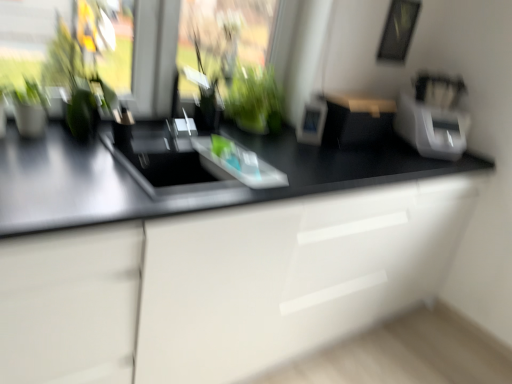
You are a GUI agent. You are given a task and a screenshot of the screen. Output one action in this format:
    pyautogui.click(x=<x>, y=<y>)
    Task: Click on the white plastic knife block at right, the 3th appliance in the left-to-right sequence
    Image resolution: width=512 pixels, height=384 pixels.
    Given the screenshot: What is the action you would take?
    pyautogui.click(x=433, y=116)

What do you see at coordinates (28, 35) in the screenshot?
I see `transparent glass window screen at upper left, positioned as the second window screen in right-to-left order` at bounding box center [28, 35].

Identify the location of green glass vase at center, which ranks as the 1th window screen in right-to-left order. (225, 34).

The height and width of the screenshot is (384, 512). Find the location of `green glossy plant at center`. green glossy plant at center is located at coordinates (255, 100).

Is transparent glass window screen at upper left, positioned as the second window screen in right-to-left order, situated inside white plastic knife block at right, the 3th appliance in the left-to-right sequence, or outside?

transparent glass window screen at upper left, positioned as the second window screen in right-to-left order, is not enclosed by white plastic knife block at right, the 3th appliance in the left-to-right sequence.

Considering the positions of objects transparent glass window screen at upper left, the 1th window screen viewed from the left, and white plastic knife block at right, the 3th appliance in the left-to-right sequence, in the image provided, who is behind, transparent glass window screen at upper left, the 1th window screen viewed from the left, or white plastic knife block at right, the 3th appliance in the left-to-right sequence,?

white plastic knife block at right, the 3th appliance in the left-to-right sequence, is behind.

Is transparent glass window screen at upper left, the 1th window screen viewed from the left, far from white plastic knife block at right, the 3th appliance in the left-to-right sequence?

Yes, transparent glass window screen at upper left, the 1th window screen viewed from the left, is far from white plastic knife block at right, the 3th appliance in the left-to-right sequence.

From their relative heights in the image, would you say white glossy cabinet at center is taller or shorter than green glossy plant at center?

Clearly, white glossy cabinet at center is taller compared to green glossy plant at center.

Is point (168, 279) closer or farther from the camera than point (259, 86)?

Point (168, 279) is positioned closer to the camera compared to point (259, 86).

Considering the relative sizes of white glossy cabinet at center and green glossy plant at center in the image provided, is white glossy cabinet at center smaller than green glossy plant at center?

Incorrect, white glossy cabinet at center is not smaller in size than green glossy plant at center.

Identify the location of the 2nd appliance directly beneath the green glass vase at center, which ranks as the 1th window screen in right-to-left order (from a real-world perspective). This screenshot has width=512, height=384. pos(356,119).

Is matte black box at center, the second appliance when ordered from left to right, outside of green glass vase at center, marked as the 2th window screen in a left-to-right arrangement?

Yes.

Can you confirm if matte black box at center, the second appliance when ordered from left to right, is thinner than green glass vase at center, which ranks as the 1th window screen in right-to-left order?

No.

Is matte black box at center, which is the 2th appliance in right-to-left order, placed right next to green glass vase at center, which ranks as the 1th window screen in right-to-left order?

No, matte black box at center, which is the 2th appliance in right-to-left order, is not beside green glass vase at center, which ranks as the 1th window screen in right-to-left order.

Between point (69, 5) and point (353, 227), which one is positioned behind?

Positioned behind is point (69, 5).

Would you consider transparent glass window screen at upper left, the 1th window screen viewed from the left, to be distant from white glossy cabinet at center?

Indeed, transparent glass window screen at upper left, the 1th window screen viewed from the left, is not near white glossy cabinet at center.

Is white glossy cabinet at center at the back of transparent glass window screen at upper left, the 1th window screen viewed from the left?

No, white glossy cabinet at center is not at the back of transparent glass window screen at upper left, the 1th window screen viewed from the left.

Which object is positioned more to the right, green glossy plant at center or matte black box at center, the second appliance when ordered from left to right?

matte black box at center, the second appliance when ordered from left to right, is more to the right.

From a real-world perspective, who is located lower, green glossy plant at center or matte black box at center, the second appliance when ordered from left to right?

matte black box at center, the second appliance when ordered from left to right, is physically lower.

Consider the image. Can you confirm if green glossy plant at center is smaller than matte black box at center, which is the 2th appliance in right-to-left order?

A: No, green glossy plant at center is not smaller than matte black box at center, which is the 2th appliance in right-to-left order.

From the image's perspective, is matte black box at center, the second appliance when ordered from left to right, positioned above or below green glossy plant at center?

Based on their image positions, matte black box at center, the second appliance when ordered from left to right, is located beneath green glossy plant at center.

Between point (341, 143) and point (249, 97), which one is positioned in front?

The point (249, 97) is closer.

Is matte black box at center, the second appliance when ordered from left to right, turned away from green glossy plant at center?

matte black box at center, the second appliance when ordered from left to right, does not have its back to green glossy plant at center.

Consider the image. Is matte black box at center, the second appliance when ordered from left to right, next to green glossy plant at center and touching it?

No, matte black box at center, the second appliance when ordered from left to right, is not beside green glossy plant at center.

Which of these two, green glossy plant at center or white plastic photo frame at center, the 1th appliance positioned from the left, is smaller?

Smaller between the two is white plastic photo frame at center, the 1th appliance positioned from the left.

Which object is positioned more to the left, green glossy plant at center or white plastic photo frame at center, arranged as the third appliance when viewed from the right?

From the viewer's perspective, green glossy plant at center appears more on the left side.

How much distance is there between green glossy plant at center and white plastic photo frame at center, the 1th appliance positioned from the left?

green glossy plant at center is 9.15 inches away from white plastic photo frame at center, the 1th appliance positioned from the left.

Which of these two, green glossy plant at center or white plastic photo frame at center, arranged as the third appliance when viewed from the right, is thinner?

white plastic photo frame at center, arranged as the third appliance when viewed from the right.

From the image's perspective, starting from the transparent glass window screen at upper left, positioned as the second window screen in right-to-left order, which appliance is the 1st one below? Please provide its 2D coordinates.

[(433, 116)]

Identify the location of cabinetry on the right side of green glossy plant at center. Image resolution: width=512 pixels, height=384 pixels. (224, 284).

Based on their spatial positions, is white plastic knife block at right, the 3th appliance in the left-to-right sequence, or transparent glass window screen at upper left, positioned as the second window screen in right-to-left order, closer to white plastic photo frame at center, the 1th appliance positioned from the left?

white plastic knife block at right, the 3th appliance in the left-to-right sequence, is positioned closer to the anchor white plastic photo frame at center, the 1th appliance positioned from the left.

Estimate the real-world distances between objects in this image. Which object is closer to white glossy cabinet at center, green glass vase at center, marked as the 2th window screen in a left-to-right arrangement, or white plastic knife block at right, which ranks as the first appliance in right-to-left order?

white plastic knife block at right, which ranks as the first appliance in right-to-left order.

Considering their positions, is green glass vase at center, which ranks as the 1th window screen in right-to-left order, positioned further to green glossy plant at center than white plastic knife block at right, the 3th appliance in the left-to-right sequence?

Among the two, white plastic knife block at right, the 3th appliance in the left-to-right sequence, is located further to green glossy plant at center.

Considering their positions, is green glass vase at center, which ranks as the 1th window screen in right-to-left order, positioned closer to transparent glass window screen at upper left, positioned as the second window screen in right-to-left order, than white plastic photo frame at center, arranged as the third appliance when viewed from the right?

green glass vase at center, which ranks as the 1th window screen in right-to-left order, is positioned closer to the anchor transparent glass window screen at upper left, positioned as the second window screen in right-to-left order.

Looking at the image, which one is located further to white plastic knife block at right, the 3th appliance in the left-to-right sequence, white glossy cabinet at center or transparent glass window screen at upper left, positioned as the second window screen in right-to-left order?

transparent glass window screen at upper left, positioned as the second window screen in right-to-left order.

In the scene shown: Considering their positions, is matte black box at center, which is the 2th appliance in right-to-left order, positioned further to green glass vase at center, marked as the 2th window screen in a left-to-right arrangement, than green glossy plant at center?

Among the two, matte black box at center, which is the 2th appliance in right-to-left order, is located further to green glass vase at center, marked as the 2th window screen in a left-to-right arrangement.

Considering their positions, is transparent glass window screen at upper left, the 1th window screen viewed from the left, positioned further to green glass vase at center, marked as the 2th window screen in a left-to-right arrangement, than white plastic photo frame at center, arranged as the third appliance when viewed from the right?

transparent glass window screen at upper left, the 1th window screen viewed from the left, is positioned further to the anchor green glass vase at center, marked as the 2th window screen in a left-to-right arrangement.

Which object lies further to the anchor point white plastic knife block at right, which ranks as the first appliance in right-to-left order, green glass vase at center, marked as the 2th window screen in a left-to-right arrangement, or transparent glass window screen at upper left, positioned as the second window screen in right-to-left order?

transparent glass window screen at upper left, positioned as the second window screen in right-to-left order, is further to white plastic knife block at right, which ranks as the first appliance in right-to-left order.

You are a GUI agent. You are given a task and a screenshot of the screen. Output one action in this format:
    pyautogui.click(x=<x>, y=<y>)
    Task: Click on the plant located between green glass vase at center, marked as the 2th window screen in a left-to-right arrangement, and matte black box at center, which is the 2th appliance in right-to-left order, in the left-right direction
    The image size is (512, 384).
    Given the screenshot: What is the action you would take?
    pyautogui.click(x=255, y=100)

Locate an element on the screen. The width and height of the screenshot is (512, 384). window screen between green glass vase at center, marked as the 2th window screen in a left-to-right arrangement, and white glossy cabinet at center from top to bottom is located at coordinates (28, 35).

Identify the location of cabinetry between transparent glass window screen at upper left, the 1th window screen viewed from the left, and matte black box at center, the second appliance when ordered from left to right, in the horizontal direction. This screenshot has width=512, height=384. (224, 284).

You are a GUI agent. You are given a task and a screenshot of the screen. Output one action in this format:
    pyautogui.click(x=<x>, y=<y>)
    Task: Click on the plant between white glossy cabinet at center and matte black box at center, which is the 2th appliance in right-to-left order, from front to back
    This screenshot has width=512, height=384.
    Given the screenshot: What is the action you would take?
    pyautogui.click(x=255, y=100)